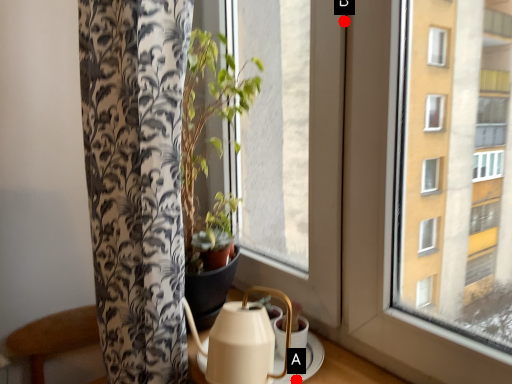
Question: Two points are circled on the image, labeled by A and B beside each circle. Which of the following is the closest to the observer?

Choices:
 (A) A is closer
 (B) B is closer

Answer: (B)